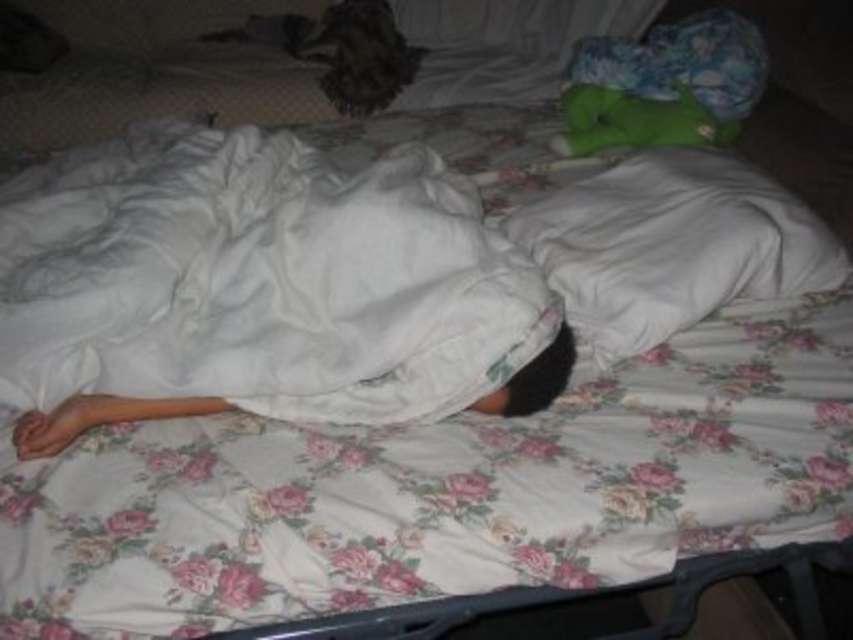
Question: Considering the relative positions of fuzzy brown cat at upper center and green plush toy at upper right in the image provided, where is fuzzy brown cat at upper center located with respect to green plush toy at upper right?

Choices:
 (A) left
 (B) right

Answer: (A)

Question: Which is farther from the green plush toy at upper right?

Choices:
 (A) fuzzy brown cat at upper center
 (B) white cotton blanket at center

Answer: (A)

Question: Considering the real-world distances, which object is closest to the fuzzy brown cat at upper center?

Choices:
 (A) white cotton blanket at center
 (B) green plush toy at upper right

Answer: (B)

Question: Can you confirm if white cotton blanket at center is positioned to the right of fuzzy brown cat at upper center?

Choices:
 (A) no
 (B) yes

Answer: (B)

Question: Is fuzzy brown cat at upper center bigger than green plush toy at upper right?

Choices:
 (A) yes
 (B) no

Answer: (A)

Question: Which point is closer to the camera?

Choices:
 (A) white cotton blanket at center
 (B) green plush toy at upper right
 (C) fuzzy brown cat at upper center

Answer: (A)